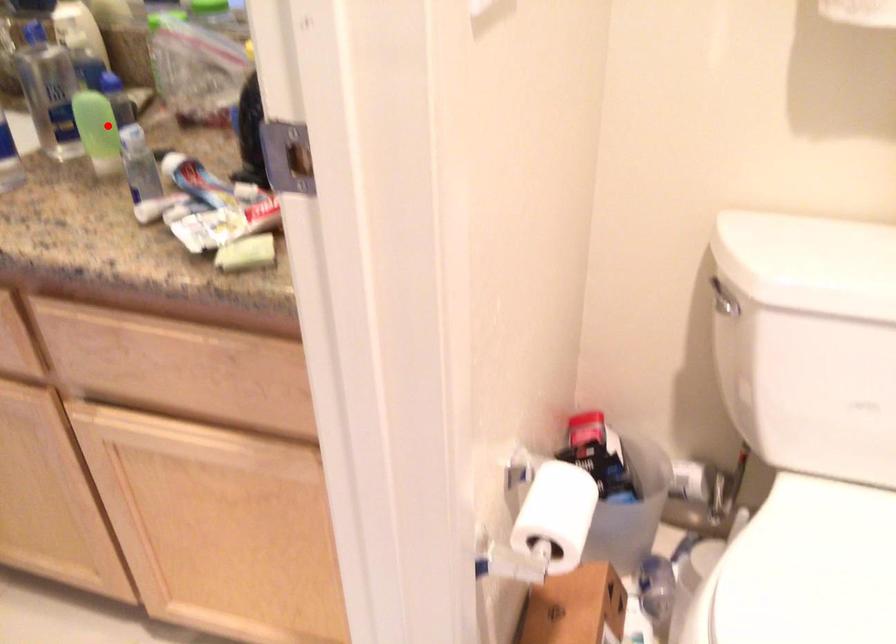
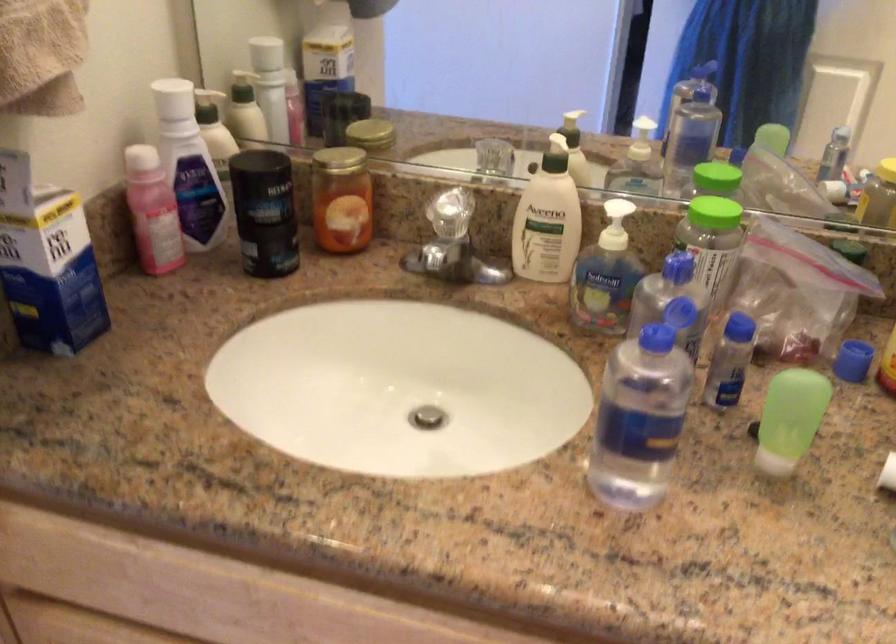
Question: I am providing you with two images of the same scene from different viewpoints. Image1 has a red point marked. In image2, the corresponding 3D location appears at what relative position? Reply with the corresponding letter.

Choices:
 (A) Closer
 (B) Farther

Answer: (A)